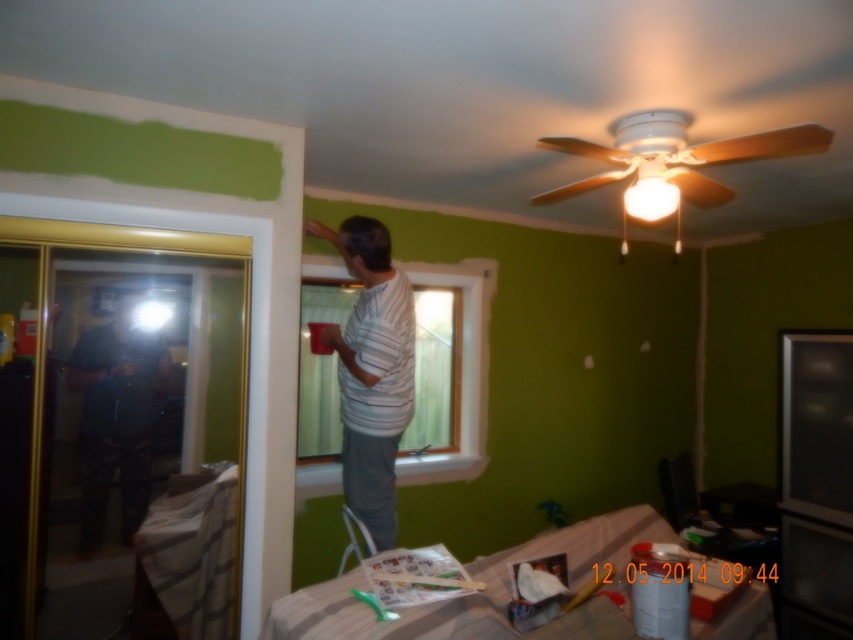
Does white striped shirt at center have a lesser height compared to clear glass window at center?

No, white striped shirt at center is not shorter than clear glass window at center.

What do you see at coordinates (370, 371) in the screenshot? The width and height of the screenshot is (853, 640). I see `white striped shirt at center` at bounding box center [370, 371].

Where is `white striped shirt at center`? The image size is (853, 640). white striped shirt at center is located at coordinates (370, 371).

Does dark blue shirt at left have a lesser width compared to clear glass window at center?

Correct, dark blue shirt at left's width is less than clear glass window at center's.

Can you confirm if dark blue shirt at left is positioned above clear glass window at center?

No.

Locate an element on the screen. The width and height of the screenshot is (853, 640). dark blue shirt at left is located at coordinates (115, 417).

Is white striped shirt at center bigger than dark blue shirt at left?

Yes, white striped shirt at center is bigger than dark blue shirt at left.

Which is more to the right, white striped shirt at center or dark blue shirt at left?

white striped shirt at center

This screenshot has width=853, height=640. Identify the location of white striped shirt at center. (370, 371).